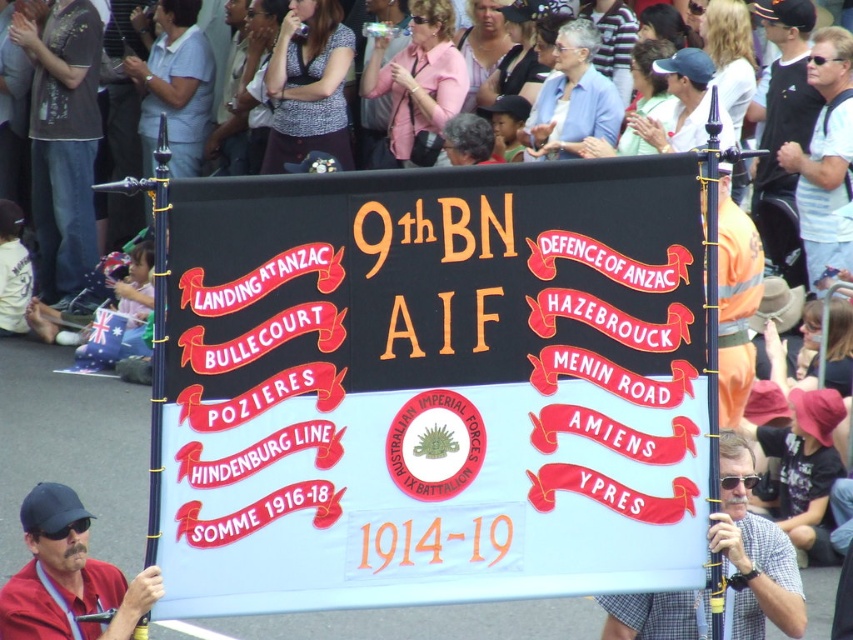
Question: Considering the real-world distances, which object is farthest from the red fabric cap at lower left?

Choices:
 (A) dark gray shirt at center
 (B) white striped shirt at upper right
 (C) checkered shirt at center
 (D) black fabric banner at center

Answer: (A)

Question: Does checkered shirt at center appear on the right side of red fabric cap at lower left?

Choices:
 (A) no
 (B) yes

Answer: (B)

Question: Is checkered shirt at center closer to the viewer compared to red fabric cap at lower left?

Choices:
 (A) yes
 (B) no

Answer: (B)

Question: Which of the following is the farthest from the observer?

Choices:
 (A) white striped shirt at upper right
 (B) checkered shirt at center
 (C) dark gray shirt at center
 (D) red fabric cap at lower left

Answer: (C)

Question: Which of the following is the closest to the observer?

Choices:
 (A) (358, 589)
 (B) (76, 540)
 (C) (738, 470)
 (D) (813, 64)

Answer: (A)

Question: Is red fabric cap at lower left thinner than white striped shirt at upper right?

Choices:
 (A) no
 (B) yes

Answer: (B)